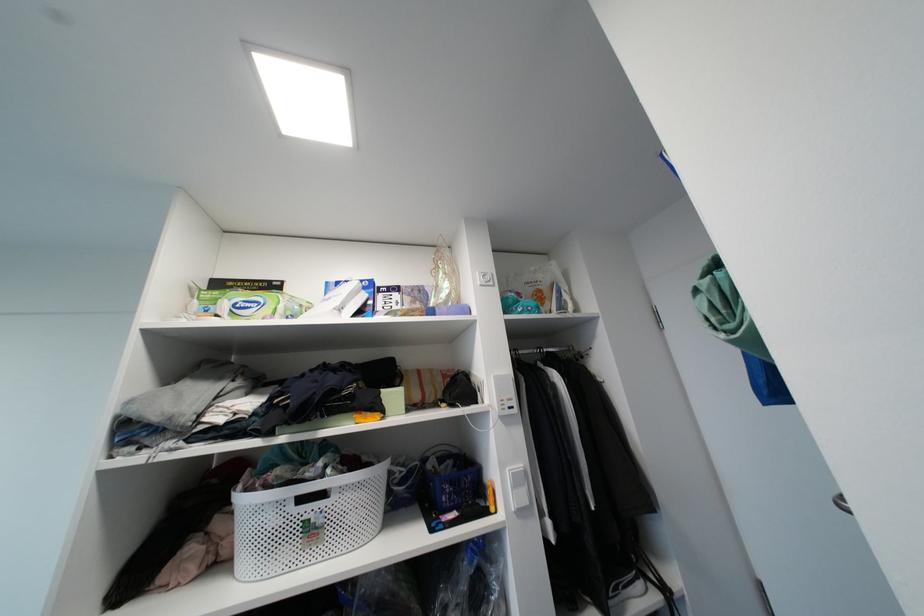
Describe the element at coordinates (841, 503) in the screenshot. I see `the metal door handle` at that location.